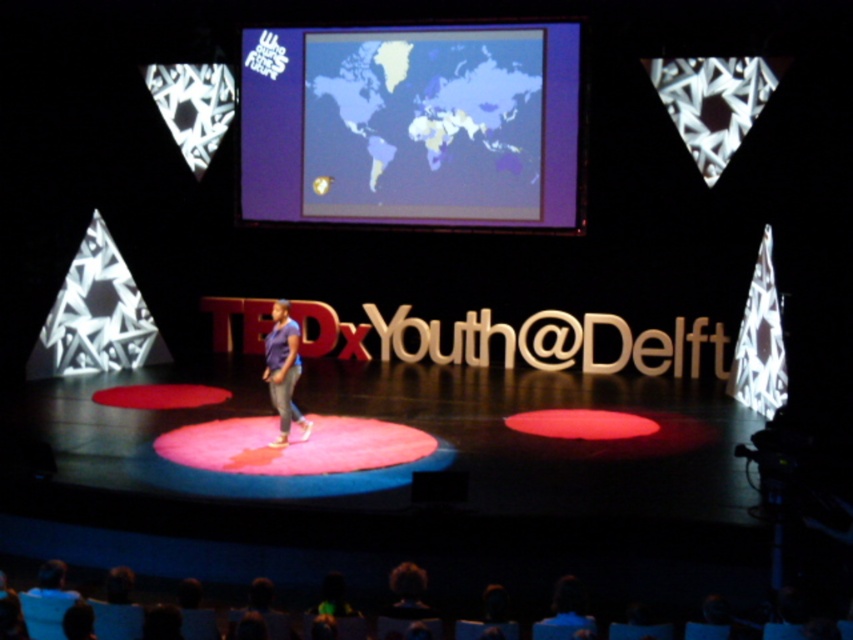
Question: Is matte plastic map at upper center wider than matte purple shirt at center?

Choices:
 (A) yes
 (B) no

Answer: (A)

Question: In this image, where is matte plastic map at upper center located relative to matte purple shirt at center?

Choices:
 (A) left
 (B) right

Answer: (B)

Question: Does matte plastic map at upper center lie in front of matte purple shirt at center?

Choices:
 (A) no
 (B) yes

Answer: (A)

Question: Among these points, which one is nearest to the camera?

Choices:
 (A) (282, 332)
 (B) (444, 77)

Answer: (A)

Question: Which of the following is the closest to the observer?

Choices:
 (A) matte purple shirt at center
 (B) matte plastic map at upper center

Answer: (A)